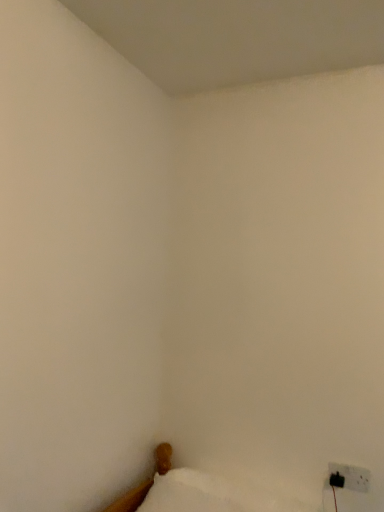
Question: Would you say black plastic electric outlet at lower right is inside or outside white fabric bed at lower right?

Choices:
 (A) inside
 (B) outside

Answer: (B)

Question: Is black plastic electric outlet at lower right in front of or behind white fabric bed at lower right in the image?

Choices:
 (A) behind
 (B) front

Answer: (A)

Question: Which object is the farthest from the white soft pillow at lower left?

Choices:
 (A) white fabric bed at lower right
 (B) black plastic electric outlet at lower right

Answer: (B)

Question: Which object is the closest to the white fabric bed at lower right?

Choices:
 (A) white soft pillow at lower left
 (B) black plastic electric outlet at lower right

Answer: (A)